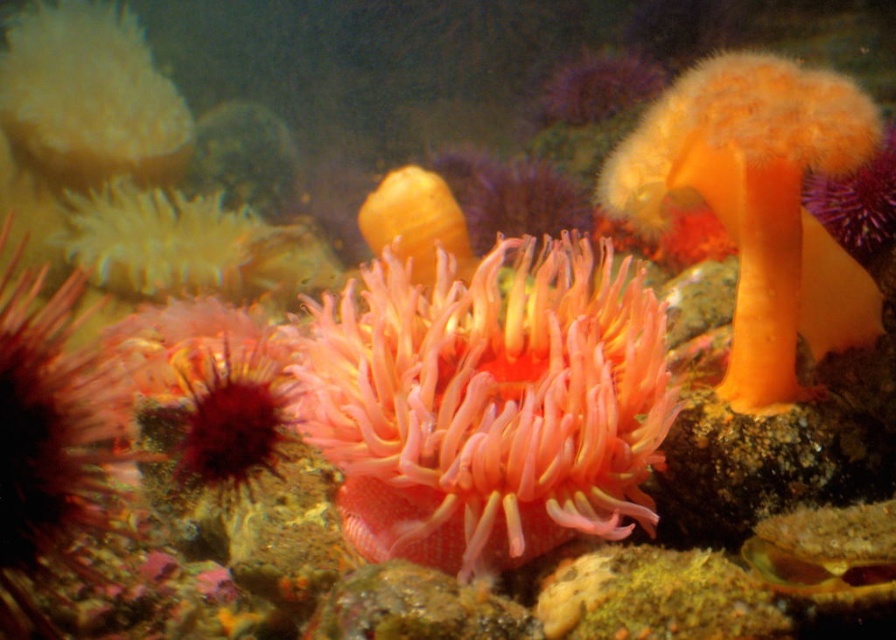
Consider the image. You are a marine biologist observing this underwater scene. You notice the pink soft coral at center and the yellow rubber duck at center. Which object is closer to you, the observer?

The pink soft coral at center is closer to you because it is in front of the yellow rubber duck at center.

You are a marine biologist examining an underwater image. You notice two points marked in the scene. The first point is at coordinates point (656,314) and the second is at point (429,180). Based on their positions, which point is nearer to the camera?

Point (656,314) is closer to the camera than point (429,180).

You are a marine biologist diving in the ocean and want to collect a sample from the point at coordinates point (629, 328). Your sampling tool has a maximum reach of 1.5 meters. Can you reach the point with your tool?

The distance of point (629, 328) from viewer is 1.39 meters, so yes, the sampling tool can reach the point since its maximum reach is 1.5 meters, which is longer than the distance to the point.